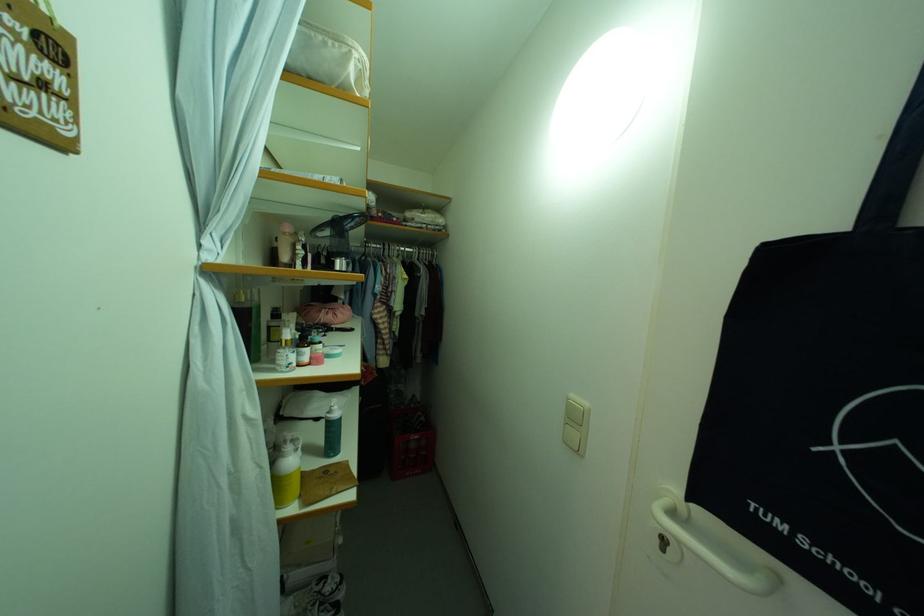
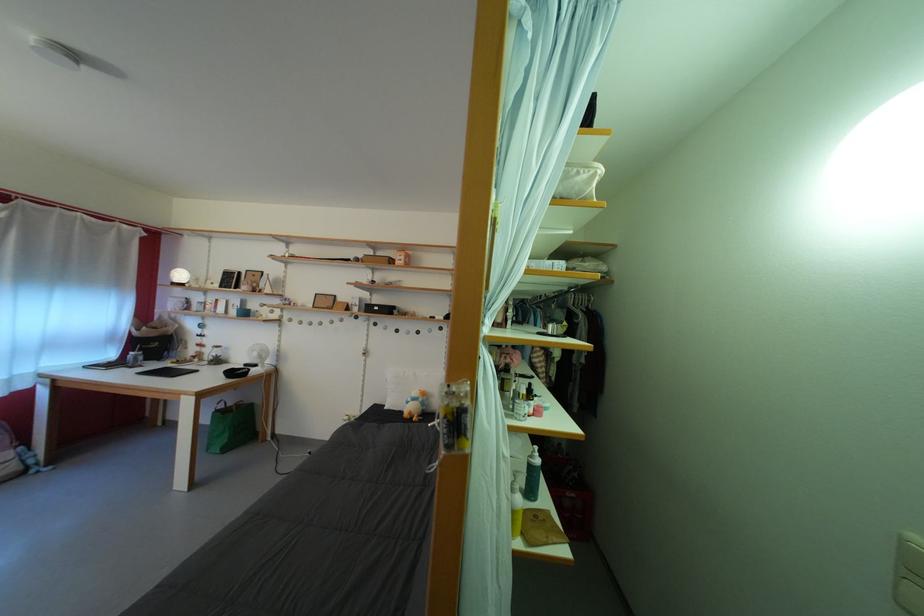
Question: The first image is from the beginning of the video and the second image is from the end. How did the camera likely rotate when shooting the video?

Choices:
 (A) Left
 (B) Right
 (C) Up
 (D) Down

Answer: (A)